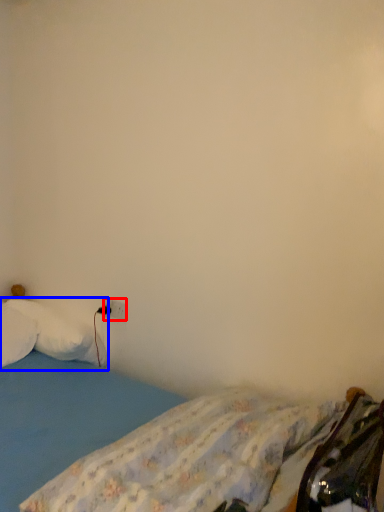
Question: Which object is closer to the camera taking this photo, electric outlet (highlighted by a red box) or pillow (highlighted by a blue box)?

Choices:
 (A) electric outlet
 (B) pillow

Answer: (B)